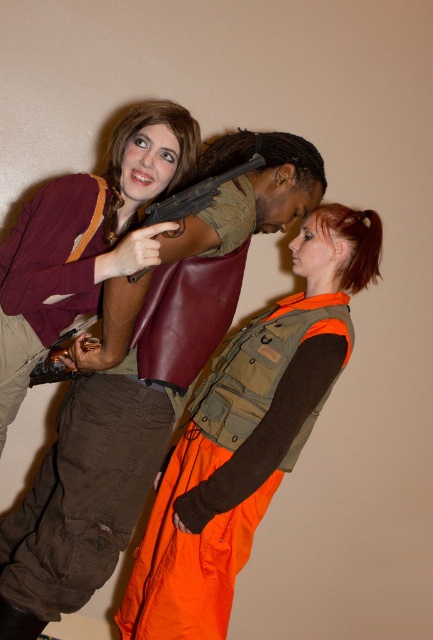
Does orange fabric vest at center have a lesser height compared to matte brown leather jacket at upper left?

No.

Which is behind, point (148, 596) or point (13, 365)?

The point (148, 596) is more distant.

Find the location of a particular element. orange fabric vest at center is located at coordinates (x=248, y=435).

Based on the photo, is orange fabric vest at center closer to the viewer compared to matte black shotgun at center?

No, it is behind matte black shotgun at center.

Is orange fabric vest at center wider than matte black shotgun at center?

Correct, the width of orange fabric vest at center exceeds that of matte black shotgun at center.

Who is more forward, (310, 426) or (158, 202)?

Point (158, 202) is more forward.

At what (x,y) coordinates should I click in order to perform the action: click on orange fabric vest at center. Please return your answer as a coordinate pair (x, y). This screenshot has width=433, height=640. Looking at the image, I should click on (248, 435).

Image resolution: width=433 pixels, height=640 pixels. Describe the element at coordinates (84, 237) in the screenshot. I see `matte brown leather jacket at upper left` at that location.

Identify the location of matte brown leather jacket at upper left. Image resolution: width=433 pixels, height=640 pixels. (84, 237).